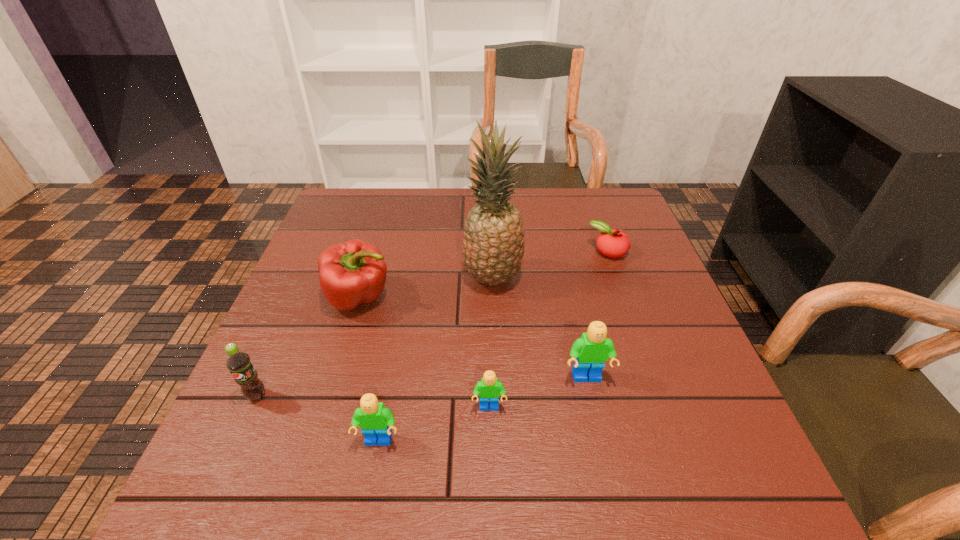
The height and width of the screenshot is (540, 960). In order to click on Lego that is the closest one to the rightmost Lego in this screenshot , I will do `click(489, 389)`.

This screenshot has height=540, width=960. I want to click on blank space that satisfies the following two spatial constraints: 1. on the back side of the apple; 2. on the right side of the tallest object, so click(492, 252).